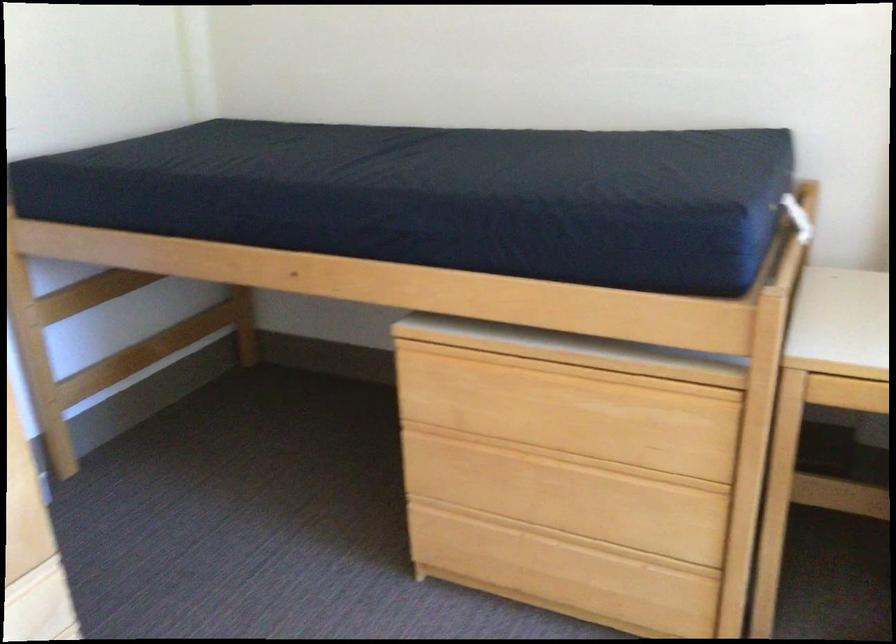
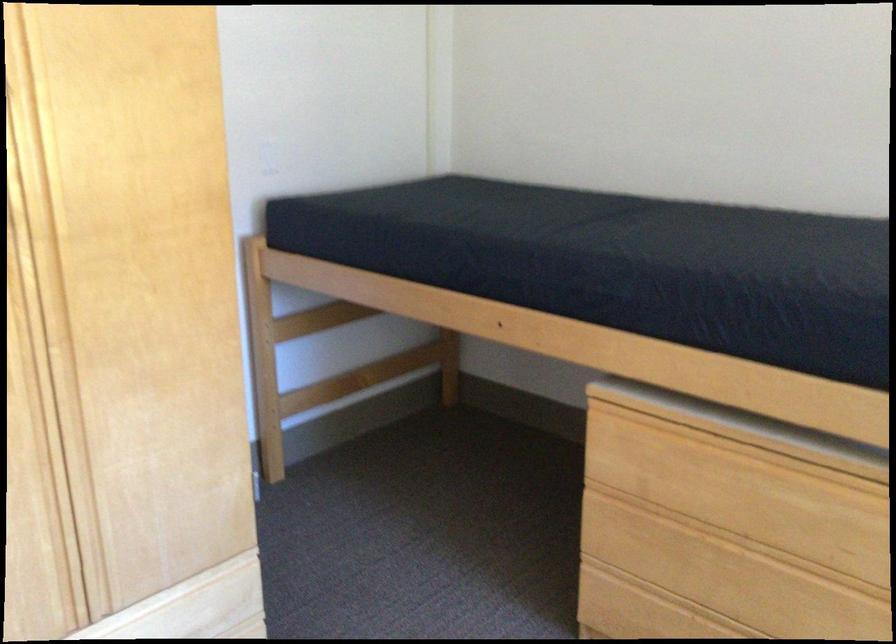
The point at (521, 493) is marked in the first image. Where is the corresponding point in the second image?

(699, 574)